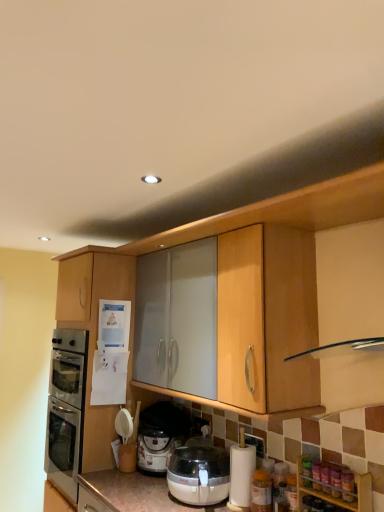
Question: Considering the positions of matte wood cabinet at left, the 2th cabinetry in the bottom-to-top sequence, and translucent plastic bottle at lower right, placed as the 1th bottle when sorted from top to bottom, in the image, is matte wood cabinet at left, the 2th cabinetry in the bottom-to-top sequence, wider or thinner than translucent plastic bottle at lower right, placed as the 1th bottle when sorted from top to bottom,?

Choices:
 (A) wide
 (B) thin

Answer: (A)

Question: Would you say matte wood cabinet at left, the second cabinetry from the front, is to the left or to the right of translucent plastic bottle at lower right, the 2th bottle positioned from the back, in the picture?

Choices:
 (A) right
 (B) left

Answer: (B)

Question: Which of these objects is positioned farthest from the translucent plastic bottle at lower right, positioned as the first bottle in front-to-back order?

Choices:
 (A) matte wood cabinet at left, the 1th cabinetry when ordered from left to right
 (B) wooden spice rack at lower right, the 1th cabinetry in the front-to-back sequence
 (C) translucent plastic bottle at lower right, the first bottle when ordered from bottom to top
 (D) translucent plastic pressure cooker at lower center

Answer: (A)

Question: Considering the real-world distances, which object is closest to the translucent plastic bottle at lower right, positioned as the first bottle in front-to-back order?

Choices:
 (A) wooden spice rack at lower right, which appears as the second cabinetry when viewed from the back
 (B) translucent plastic bottle at lower right, which is the first bottle from left to right
 (C) translucent plastic pressure cooker at lower center
 (D) matte wood cabinet at left, the 1th cabinetry positioned from the top

Answer: (A)